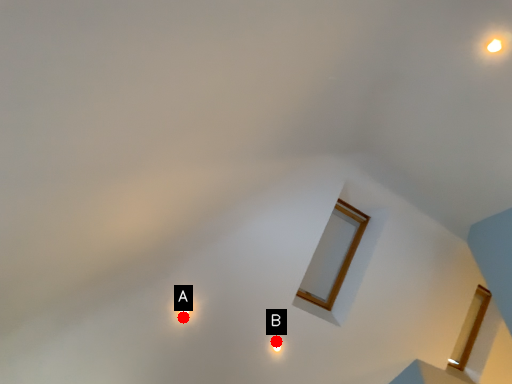
Question: Two points are circled on the image, labeled by A and B beside each circle. Which point is closer to the camera?

Choices:
 (A) A is closer
 (B) B is closer

Answer: (A)